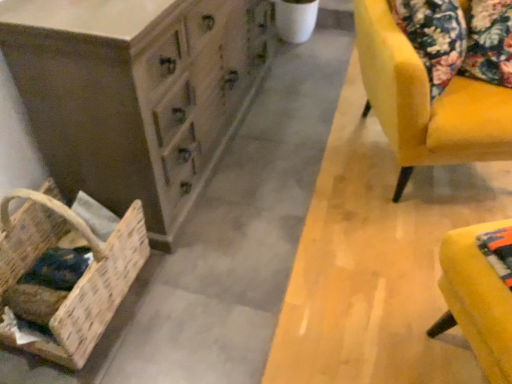
Identify the location of vacant area that lies between velvet yellow chair at right and wooden chest of drawers at lower left. (296, 172).